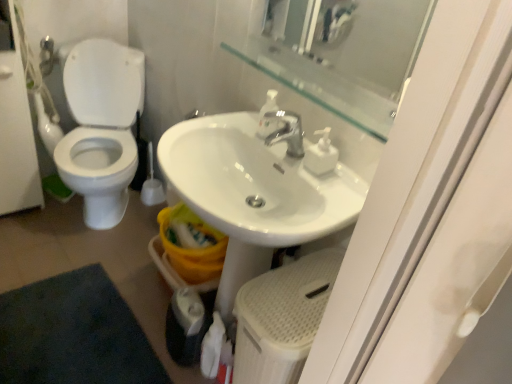
Question: From a real-world perspective, relative to transparent glass mirror at upper center, is white plastic soap dispenser at center, which is the 2th soap dispenser in left-to-right order, vertically above or below?

Choices:
 (A) below
 (B) above

Answer: (A)

Question: Is point (305, 165) positioned closer to the camera than point (258, 49)?

Choices:
 (A) farther
 (B) closer

Answer: (B)

Question: Which object is the closest to the white plastic soap dispenser at center, the first soap dispenser viewed from the right?

Choices:
 (A) transparent glass mirror at upper center
 (B) white plastic brush at left
 (C) white matte toilet paper at lower center
 (D) transparent glass mirror at upper center
 (E) white glossy toilet at left

Answer: (A)

Question: Which object is the closest to the transparent glass mirror at upper center?

Choices:
 (A) white plastic soap dispenser at center, the first soap dispenser viewed from the right
 (B) white matte toilet paper at lower center
 (C) white glossy screen door at left
 (D) white textured step stool at lower center
 (E) white plastic brush at left

Answer: (A)